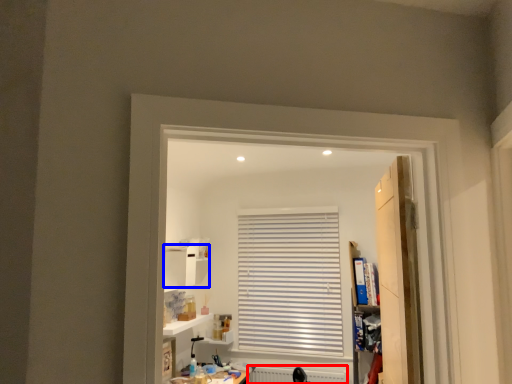
Question: Which of the following is the farthest to the observer, radiator (highlighted by a red box) or cabinet (highlighted by a blue box)?

Choices:
 (A) radiator
 (B) cabinet

Answer: (A)